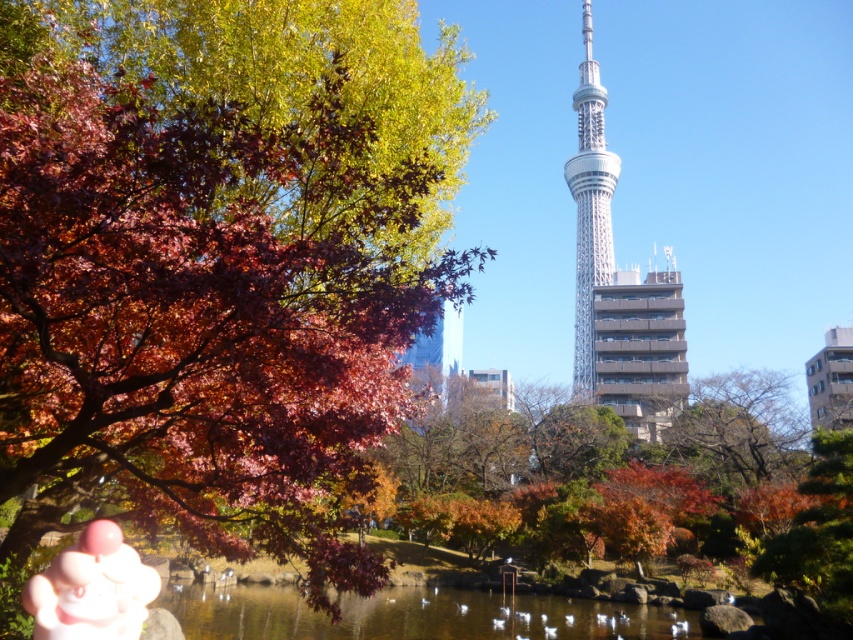
You are a photographer setting up a tripod to capture the pink rubber hand at lower left and the silver metallic tower at center. Which object requires a wider lens to capture its full width in the frame?

The silver metallic tower at center requires a wider lens because it is thicker than the pink rubber hand at lower left, so capturing its full width would need a wider angle to include all parts in the frame.

You are standing at the point with coordinates (415,614) in the autumn scene. What do you see directly in front of you?

At point (415,614) lies transparent water at center.

You are standing in the autumn scene and want to place a small marker at both points mentioned. Which point is closer to you, point (x=498, y=630) or point (x=103, y=544)?

Point (x=498, y=630) is further to the viewer than point (x=103, y=544), so point (x=103, y=544) is closer to you.